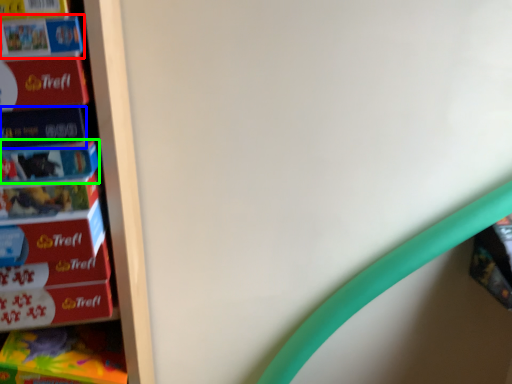
Question: Considering the real-world distances, which object is farthest from book (highlighted by a red box)? paperback book (highlighted by a blue box) or paperback book (highlighted by a green box)?

Choices:
 (A) paperback book
 (B) paperback book

Answer: (B)